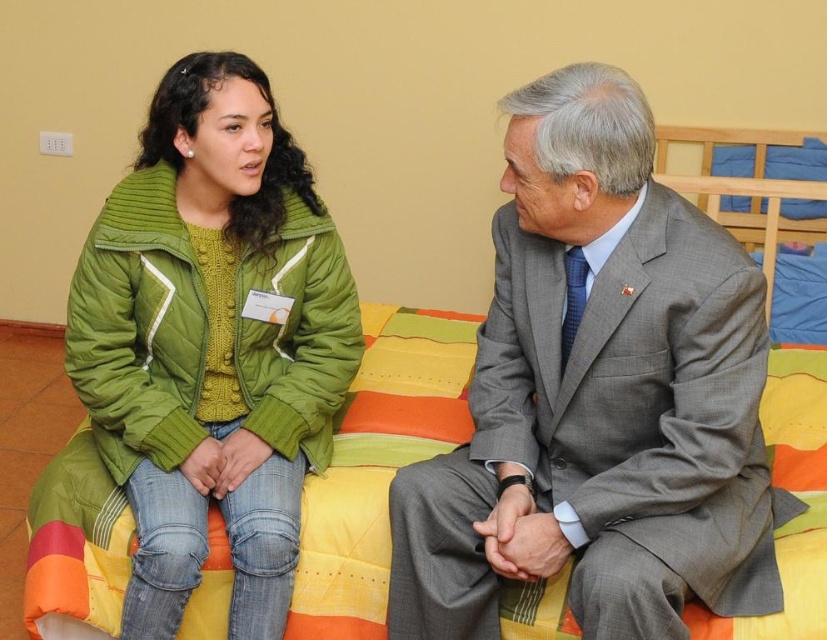
Is gray wool suit at center to the right of green quilted jacket at upper left from the viewer's perspective?

Indeed, gray wool suit at center is positioned on the right side of green quilted jacket at upper left.

Is gray wool suit at center shorter than green quilted jacket at upper left?

Yes.

Is point (495, 374) more distant than point (356, 337)?

No.

I want to click on gray wool suit at center, so click(x=598, y=396).